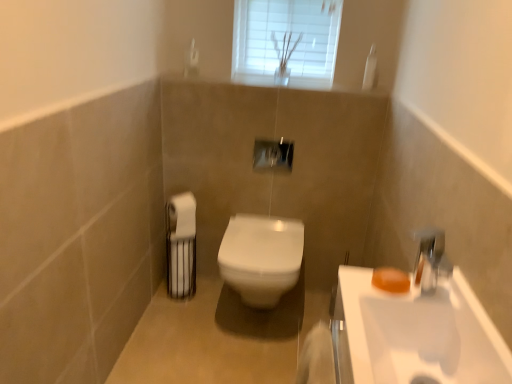
Locate an element on the screen. This screenshot has height=384, width=512. free point below white glossy toilet at center (from a real-world perspective) is located at coordinates (251, 319).